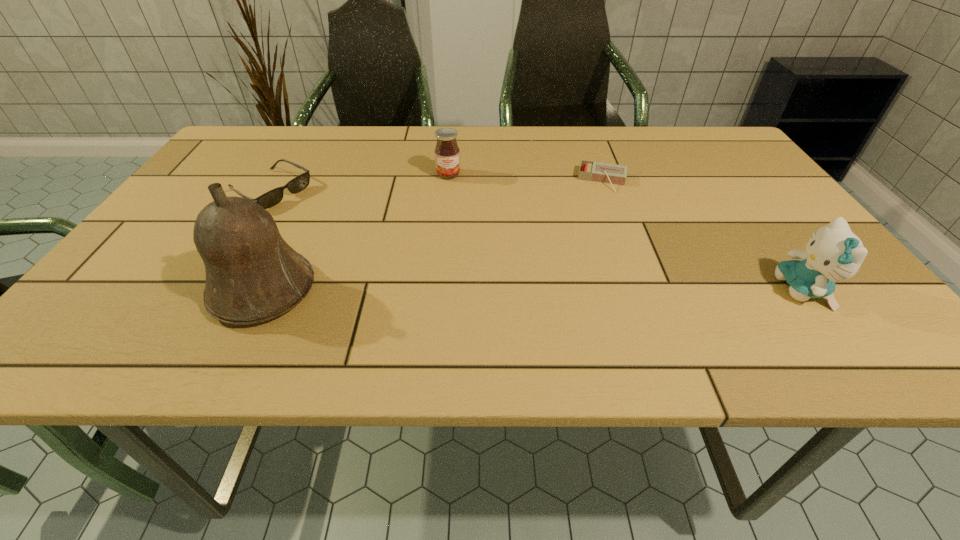
Image resolution: width=960 pixels, height=540 pixels. Find the location of `bell`. bell is located at coordinates (252, 275).

You are a GUI agent. You are given a task and a screenshot of the screen. Output one action in this format:
    pyautogui.click(x=<x>, y=<y>)
    Task: Click on the second tallest object
    
    Given the screenshot: What is the action you would take?
    pyautogui.click(x=834, y=253)

Find the location of `kitten`. kitten is located at coordinates (834, 253).

Locate an element on the screen. the shortest object is located at coordinates (600, 172).

Identify the location of matchbox. (600, 172).

Find the location of a particular element. The width and height of the screenshot is (960, 540). the third object from right to left is located at coordinates (447, 153).

You are a GUI agent. You are given a task and a screenshot of the screen. Output one action in this format:
    pyautogui.click(x=<x>, y=<y>)
    Task: Click on the third shortest object
    The image size is (960, 540).
    Given the screenshot: What is the action you would take?
    pyautogui.click(x=447, y=153)

You are a GUI agent. You are given a task and a screenshot of the screen. Output one action in this format:
    pyautogui.click(x=<x>, y=<y>)
    Task: Click on the fourth tallest object
    The width and height of the screenshot is (960, 540).
    Given the screenshot: What is the action you would take?
    pyautogui.click(x=271, y=198)

Locate an element on the screen. The height and width of the screenshot is (540, 960). vacant area situated on the right of the bell is located at coordinates (397, 291).

Find the location of a particular element. This screenshot has height=540, width=960. free space located on the face of the kitten is located at coordinates (685, 290).